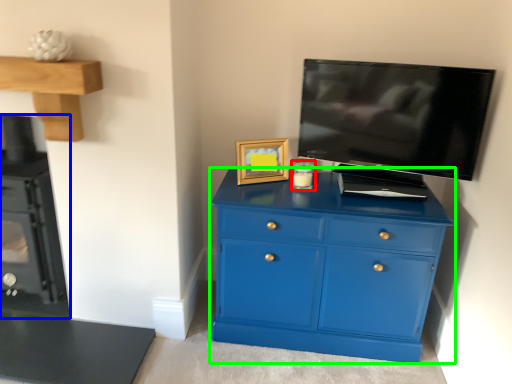
Question: Which is nearer to the candle holder (highlighted by a red box)? appliance (highlighted by a blue box) or chest of drawers (highlighted by a green box).

Choices:
 (A) appliance
 (B) chest of drawers

Answer: (B)